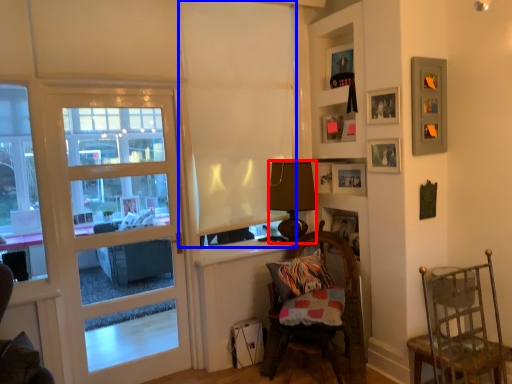
Question: Which object appears farthest to the camera in this image, lamp (highlighted by a red box) or curtain (highlighted by a blue box)?

Choices:
 (A) lamp
 (B) curtain

Answer: (A)